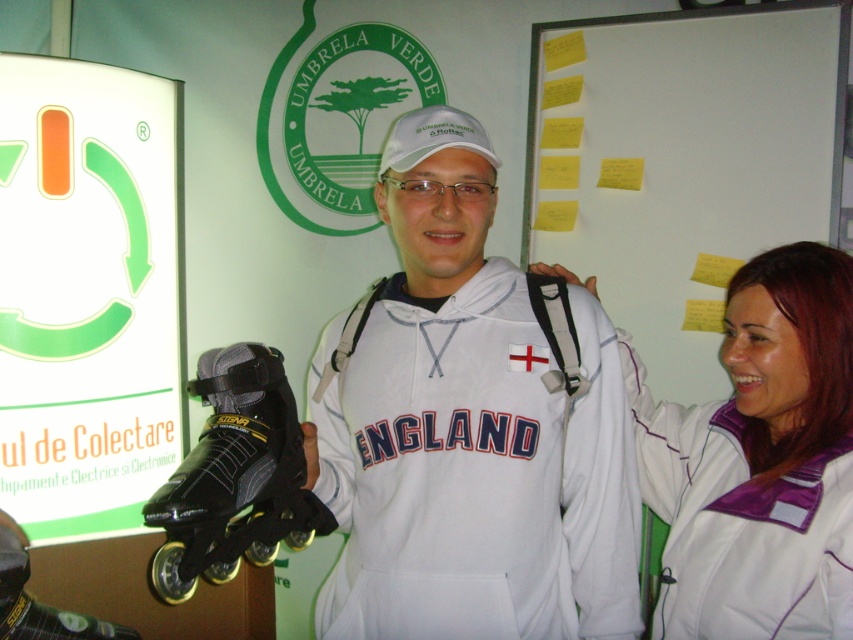
Question: Does white matte sweatshirt at center appear over black rubber roller skate at center?

Choices:
 (A) no
 (B) yes

Answer: (B)

Question: Where is white matte sweatshirt at center located in relation to green matte sign at upper left in the image?

Choices:
 (A) above
 (B) below

Answer: (B)

Question: Estimate the real-world distances between objects in this image. Which object is farther from the white fleece jacket at center?

Choices:
 (A) white matte sweatshirt at center
 (B) yellow paper at upper center
 (C) green matte sign at upper left

Answer: (C)

Question: From the image, what is the correct spatial relationship of yellow paper at upper center in relation to black rubber roller skate at center?

Choices:
 (A) left
 (B) right

Answer: (B)

Question: Which point is closer to the camera?

Choices:
 (A) (1, 420)
 (B) (676, 310)
 (C) (260, 512)

Answer: (C)

Question: Which object is positioned closest to the yellow paper at upper center?

Choices:
 (A) white fleece jacket at center
 (B) white matte sweatshirt at center
 (C) green matte sign at upper left

Answer: (A)